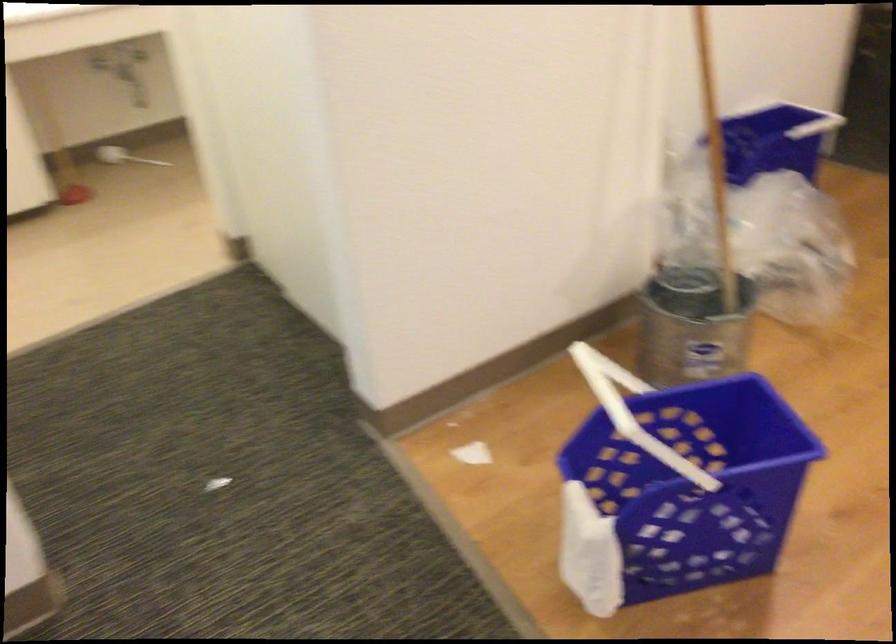
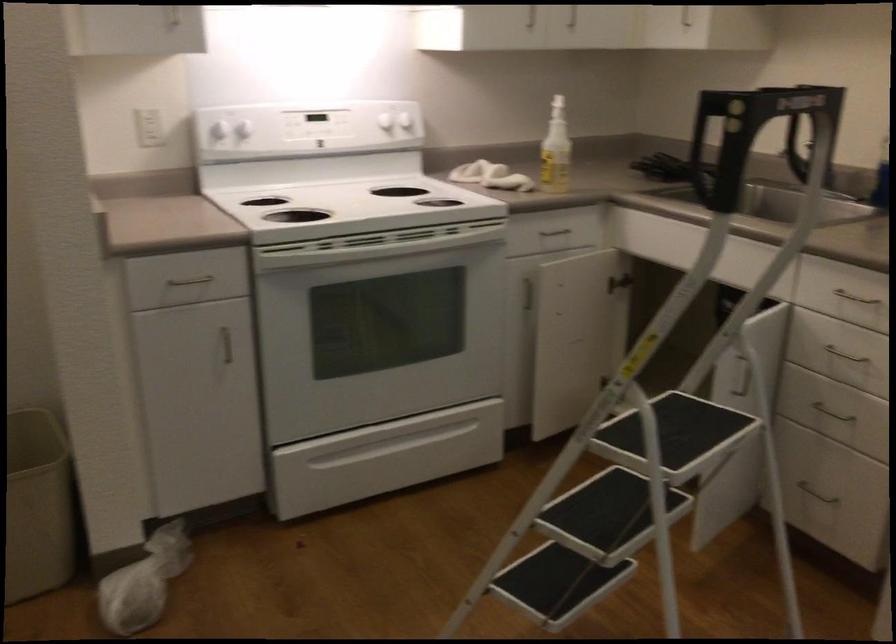
Question: The camera is either moving clockwise (left) or counter-clockwise (right) around the object. The first image is from the beginning of the video and the second image is from the end. Is the camera moving left or right when shooting the video?

Choices:
 (A) Left
 (B) Right

Answer: (A)